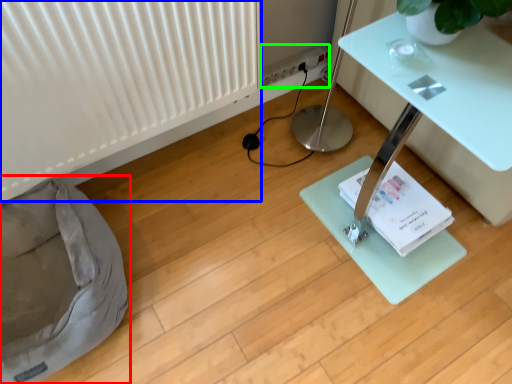
Question: Which object is the closest to the bean bag chair (highlighted by a red box)? Choose among these: radiator (highlighted by a blue box) or electric outlet (highlighted by a green box).

Choices:
 (A) radiator
 (B) electric outlet

Answer: (A)